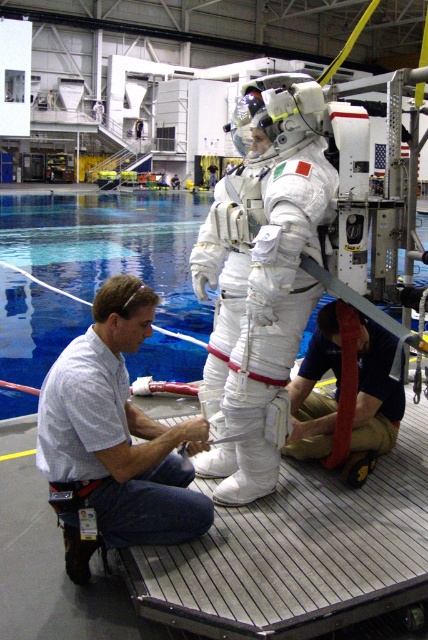
You are an engineer in the facility and need to reach the red fabric strap at lower center to adjust it. You are currently holding the white shirt at center. Can you comfortably reach the strap without moving your position?

The distance between the white shirt at center and the red fabric strap at lower center is 33.26 inches. Since the average human arm length is about 27 inches, you would likely need to move closer to comfortably reach the strap.

You are an engineer in the space simulation facility. You need to reach a point marked at coordinates point [47,260] that is 10.87 meters away from your current position. The facility has a safety rule that states you must stay within 10 meters of the control room at all times. Can you safely reach the point without violating the safety rule?

The point [47,260] is 10.87 meters away from the camera, which exceeds the 10 meter safety limit. Therefore, you cannot safely reach the point without violating the safety rule.

Consider the image. You are an astronaut preparing for a training session in the Neutral Buoyancy Laboratory. You need to ensure that the white matte spacesuit at center is submerged in the blue glossy water at center. Based on their positions, can you confirm if the spacesuit is already in the water?

The white matte spacesuit at center is in front of the blue glossy water at center, which means it is positioned closer to the observer and not submerged yet. To submerge it, you would need to move it further into the water.